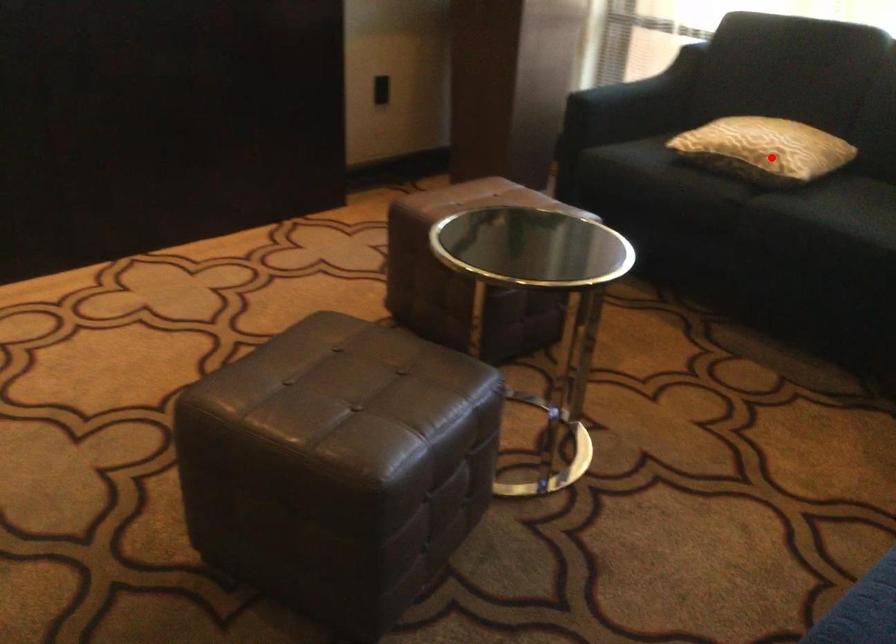
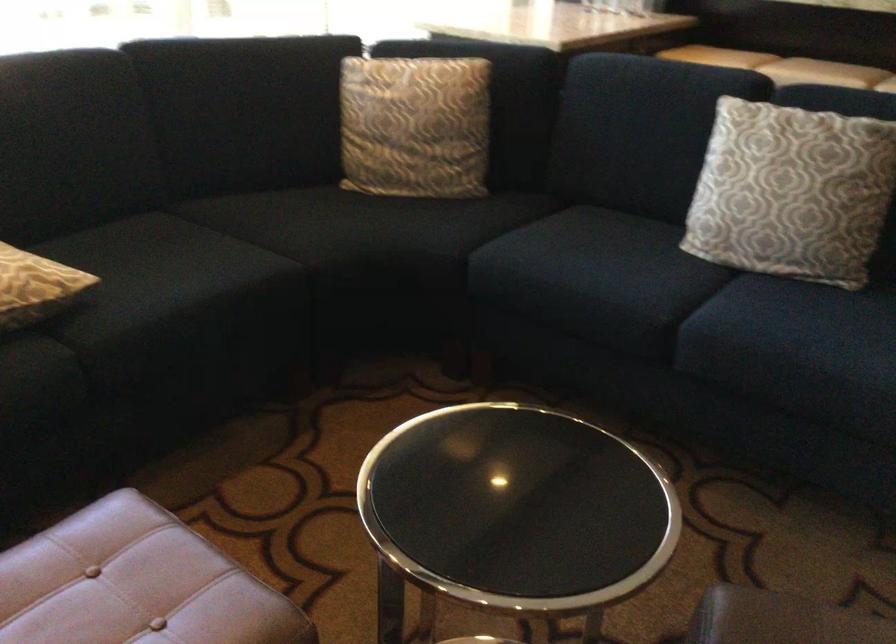
Question: I am providing you with two images of the same scene from different viewpoints. A red point is shown in image1. For the corresponding object point in image2, is it positioned nearer or farther from the camera?

Choices:
 (A) Nearer
 (B) Farther

Answer: (A)